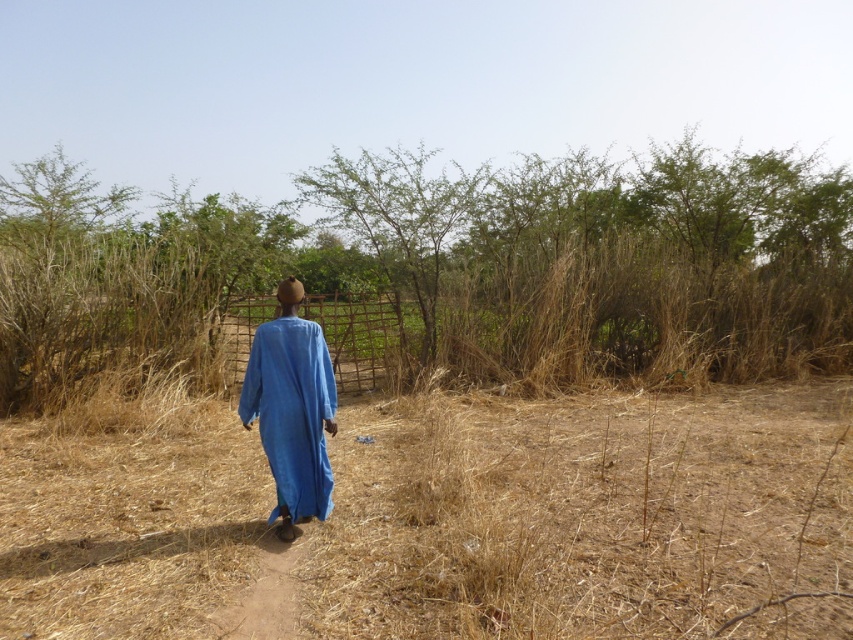
Does brown dry bush at center have a greater height compared to brown dirt path at center?

Indeed, brown dry bush at center has a greater height compared to brown dirt path at center.

Is brown dry bush at center smaller than brown dirt path at center?

Incorrect, brown dry bush at center is not smaller in size than brown dirt path at center.

Which is behind, point (131, 300) or point (265, 592)?

Point (131, 300)

Locate an element on the screen. Image resolution: width=853 pixels, height=640 pixels. brown dry bush at center is located at coordinates (444, 268).

Looking at this image, which of these two, blue cotton robe at center or brown dirt path at center, stands shorter?

With less height is brown dirt path at center.

Between blue cotton robe at center and brown dirt path at center, which one has more height?

blue cotton robe at center is taller.

Measure the distance between blue cotton robe at center and camera.

blue cotton robe at center and camera are 5.08 meters apart.

I want to click on blue cotton robe at center, so click(292, 412).

Can you confirm if brown dry bush at center is positioned above blue cotton robe at center?

Indeed, brown dry bush at center is positioned over blue cotton robe at center.

This screenshot has width=853, height=640. What do you see at coordinates (444, 268) in the screenshot?
I see `brown dry bush at center` at bounding box center [444, 268].

The height and width of the screenshot is (640, 853). I want to click on brown dry bush at center, so 444,268.